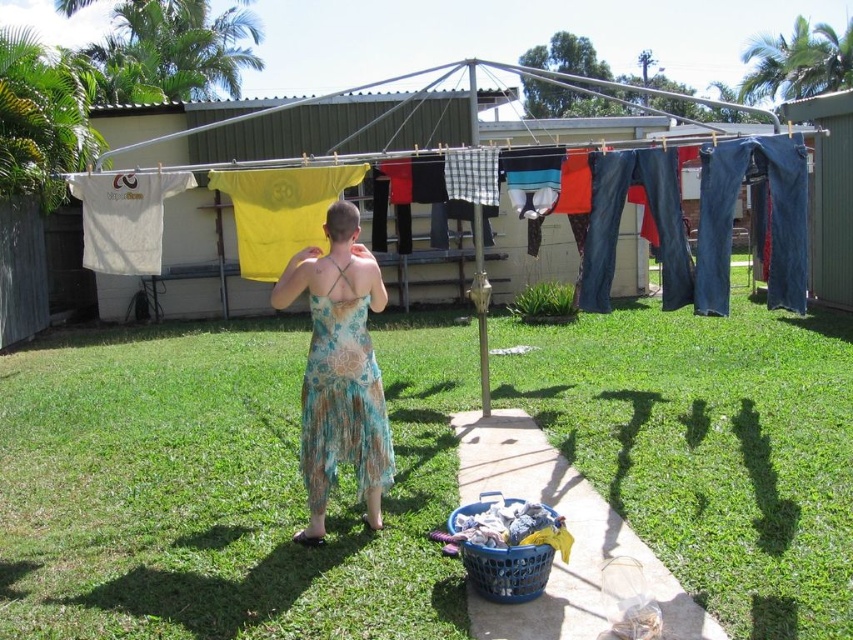
You are standing in the backyard looking at the clothesline. There are two points marked on the clothesline at coordinates point (677, 442) and point (299, 228). Which point is closer to your eyes?

Point (677, 442) is closer to the camera than point (299, 228), so the point closer to your eyes is point (677, 442).

In the scene shown: You are a photographer trying to capture the scene of the backyard with the clothesline. You notice two specific points marked as point (293, 216) and point (357, 280) in the image. Which point is closer to your camera lens?

Point (293, 216) is further to the camera than point (357, 280), so the point closer to the camera lens is point (357, 280).

Looking at this image, in the backyard scene, you see the denim jeans at upper center and the floral fabric dress at center. Which item is positioned to the right of the other?

The denim jeans at upper center are to the right of the floral fabric dress at center.